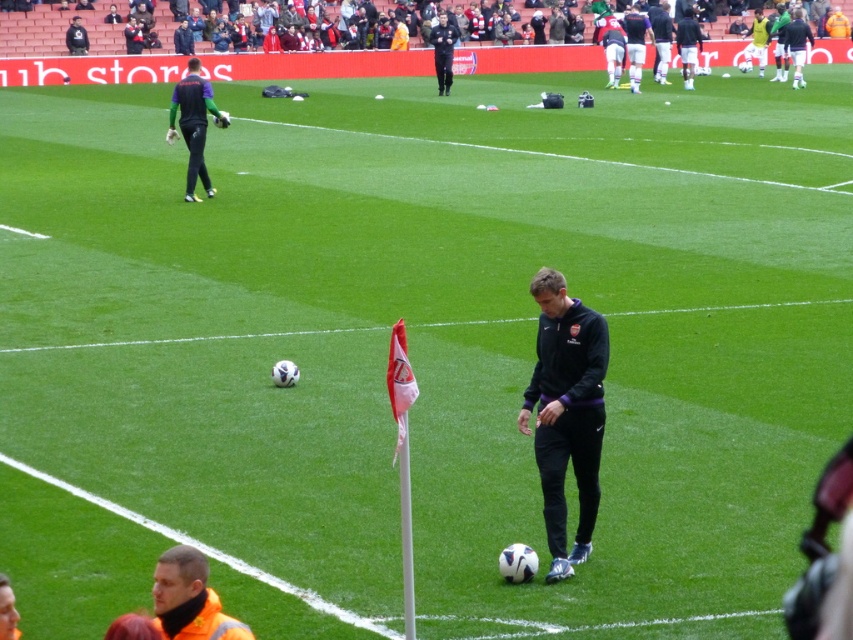
Question: Among these points, which one is farthest from the camera?

Choices:
 (A) (590, 454)
 (B) (173, 106)

Answer: (B)

Question: Is black fleece jacket at center smaller than dark green jersey at upper left?

Choices:
 (A) yes
 (B) no

Answer: (B)

Question: Which object is positioned closest to the dark green jersey at upper left?

Choices:
 (A) reflective orange vest at lower center
 (B) black fleece jacket at center

Answer: (B)

Question: Does reflective orange vest at lower center lie in front of dark green jersey at upper left?

Choices:
 (A) no
 (B) yes

Answer: (B)

Question: In this image, where is reflective orange vest at lower center located relative to dark green jersey at upper left?

Choices:
 (A) left
 (B) right

Answer: (B)

Question: Which of the following is the farthest from the observer?

Choices:
 (A) reflective orange vest at lower center
 (B) dark green jersey at upper left
 (C) black fleece jacket at center

Answer: (B)